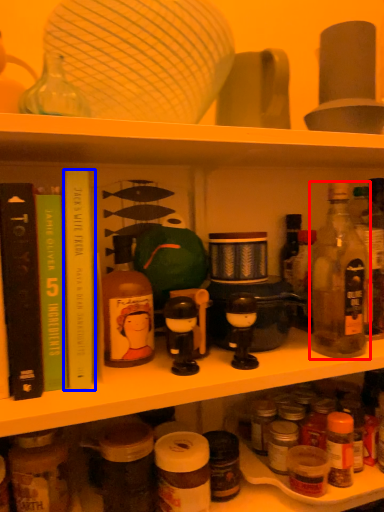
Question: Which object is further to the camera taking this photo, bottle (highlighted by a red box) or book (highlighted by a blue box)?

Choices:
 (A) bottle
 (B) book

Answer: (A)